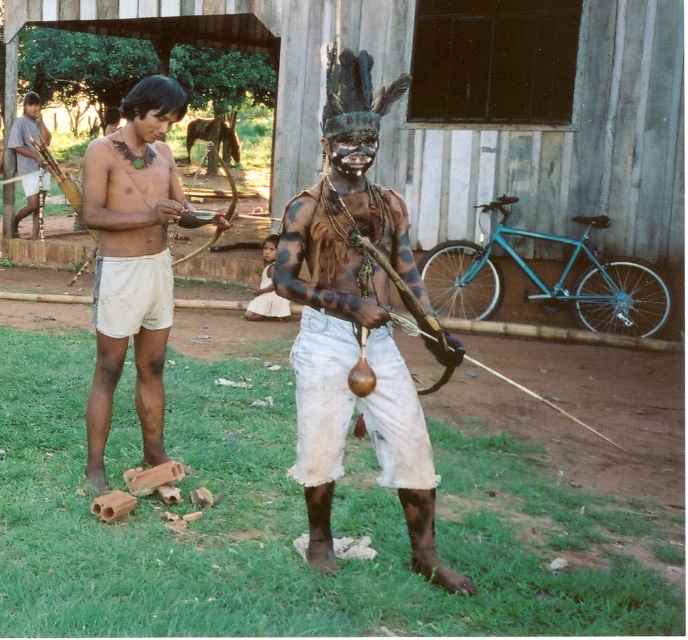
Between matte brown wooden stick at left and white cotton skirt at center, which one has less height?

white cotton skirt at center

Consider the image. Does matte brown wooden stick at left have a larger size compared to white cotton skirt at center?

Indeed, matte brown wooden stick at left has a larger size compared to white cotton skirt at center.

What do you see at coordinates (30, 160) in the screenshot?
I see `matte brown wooden stick at left` at bounding box center [30, 160].

At what (x,y) coordinates should I click in order to perform the action: click on matte brown wooden stick at left. Please return your answer as a coordinate pair (x, y). Looking at the image, I should click on (30, 160).

Where is `matte black bow at center`? The width and height of the screenshot is (688, 640). matte black bow at center is located at coordinates (354, 323).

What do you see at coordinates (354, 323) in the screenshot? I see `matte black bow at center` at bounding box center [354, 323].

Who is more distant from viewer, (394, 404) or (34, 163)?

The point (34, 163) is behind.

In order to click on matte black bow at center in this screenshot , I will do `click(354, 323)`.

Is point (334, 404) farther from camera compared to point (247, 314)?

That is False.

The width and height of the screenshot is (688, 640). Find the location of `matte black bow at center`. matte black bow at center is located at coordinates (354, 323).

Where is `matte black bow at center`? This screenshot has width=688, height=640. matte black bow at center is located at coordinates (354, 323).